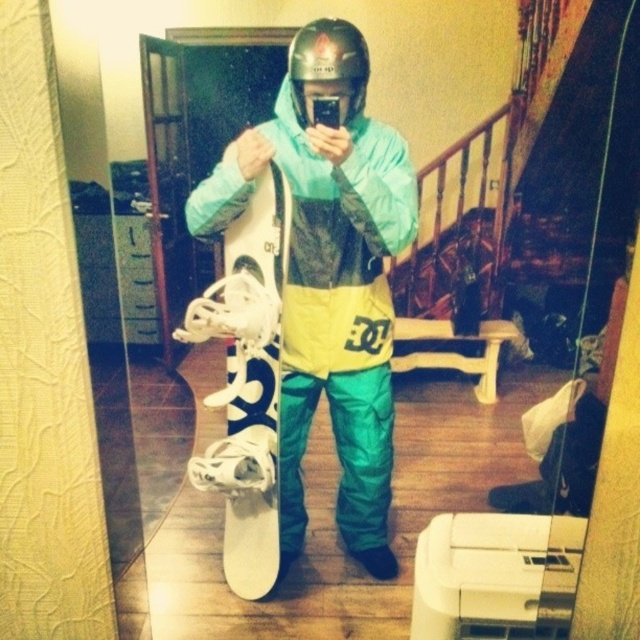
You are trying to figure out the position of the snowboards in the image. Since there are two snowboards labeled as matte white snowboard at center and white matte snowboard at center, which one is positioned to the right?

The matte white snowboard at center is positioned to the right of the white matte snowboard at center according to the description.

You are trying to take a mirror selfie in a room with a white chest freezer. You see two snowboards labeled matte white snowboard at center and white matte snowboard at center. Which one is closer to the camera?

The matte white snowboard at center is closer to the camera because it is in front of the white matte snowboard at center.